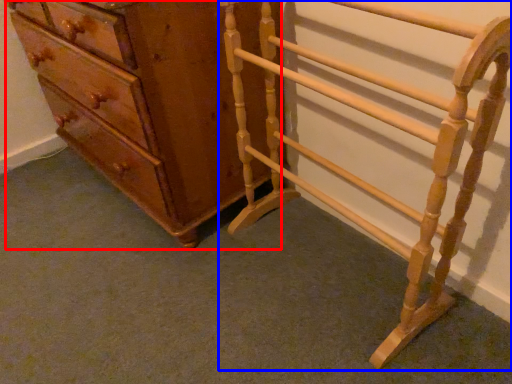
Question: Which point is further to the camera, chest of drawers (highlighted by a red box) or furniture (highlighted by a blue box)?

Choices:
 (A) chest of drawers
 (B) furniture

Answer: (A)